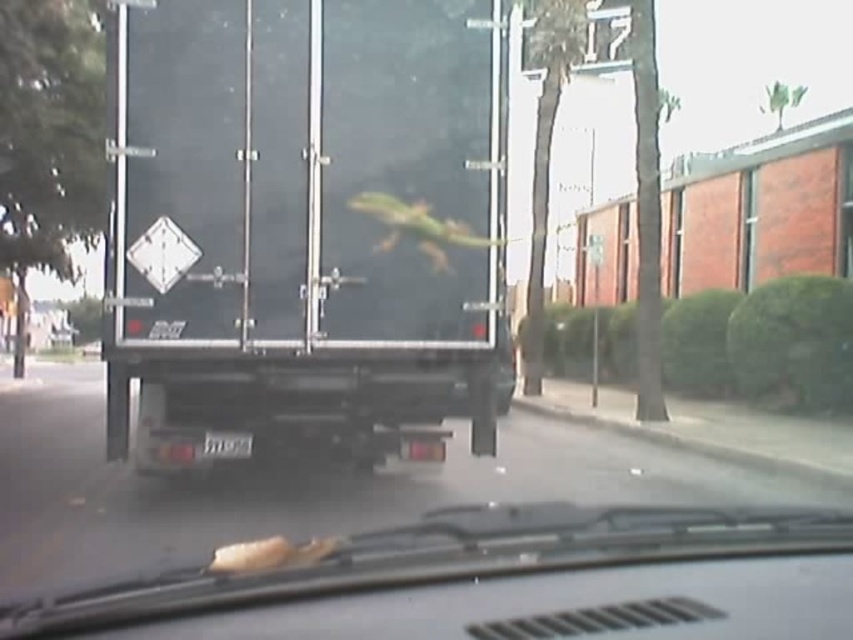
Question: Can you confirm if black matte trailer truck at center is thinner than metallic gray car at center?

Choices:
 (A) no
 (B) yes

Answer: (B)

Question: Which point is closer to the camera?

Choices:
 (A) metallic gray car at center
 (B) black matte trailer truck at center

Answer: (A)

Question: Does black matte trailer truck at center appear over metallic gray car at center?

Choices:
 (A) yes
 (B) no

Answer: (A)

Question: Is black matte trailer truck at center wider than metallic gray car at center?

Choices:
 (A) yes
 (B) no

Answer: (B)

Question: Which point is farther to the camera?

Choices:
 (A) metallic gray car at center
 (B) black matte trailer truck at center

Answer: (B)

Question: Which point is closer to the camera?

Choices:
 (A) black matte trailer truck at center
 (B) metallic gray car at center

Answer: (B)